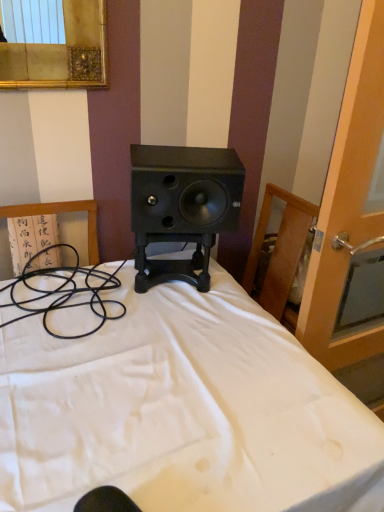
Question: Would you say white matte bed at center is to the left or to the right of transparent glass screen door at right in the picture?

Choices:
 (A) left
 (B) right

Answer: (A)

Question: Does point (140, 429) appear closer or farther from the camera than point (372, 41)?

Choices:
 (A) closer
 (B) farther

Answer: (A)

Question: Which of these objects is positioned farthest from the white matte bed at center?

Choices:
 (A) transparent glass screen door at right
 (B) black matte speaker at center

Answer: (A)

Question: Considering the real-world distances, which object is farthest from the white matte bed at center?

Choices:
 (A) transparent glass screen door at right
 (B) black matte speaker at center

Answer: (A)